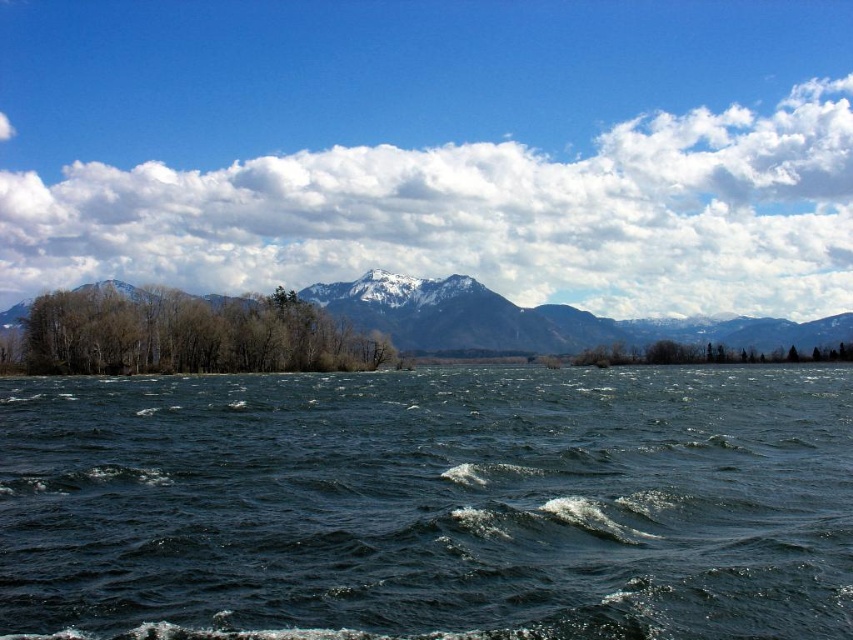
Between point (86, 209) and point (660, 356), which one is positioned in front?

Point (660, 356)

Is point (758, 268) closer to camera compared to point (619, 355)?

No, it is behind (619, 355).

What are the coordinates of `white fluffy cloud at upper center` in the screenshot? It's located at (480, 216).

In the scene shown: Which is above, white fluffy cloud at upper center or green leafy trees at lower left?

white fluffy cloud at upper center

Is white fluffy cloud at upper center taller than green leafy trees at lower left?

Indeed, white fluffy cloud at upper center has a greater height compared to green leafy trees at lower left.

Between point (184, 211) and point (233, 324), which one is positioned in front?

Positioned in front is point (233, 324).

Locate an element on the screen. The height and width of the screenshot is (640, 853). white fluffy cloud at upper center is located at coordinates (480, 216).

Between point (189, 600) and point (456, 324), which one is positioned behind?

The point (456, 324) is more distant.

Who is lower down, dark blue water at center or snowy mountain at upper center?

Positioned lower is dark blue water at center.

Does point (756, 544) lie in front of point (659, 330)?

Yes, point (756, 544) is closer to viewer.

Where is `dark blue water at center`? This screenshot has height=640, width=853. dark blue water at center is located at coordinates (428, 504).